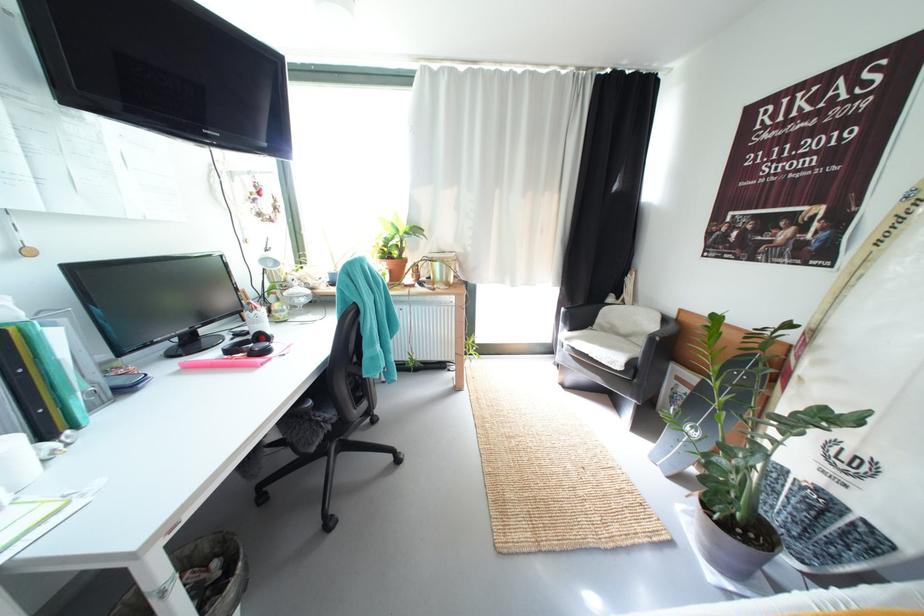
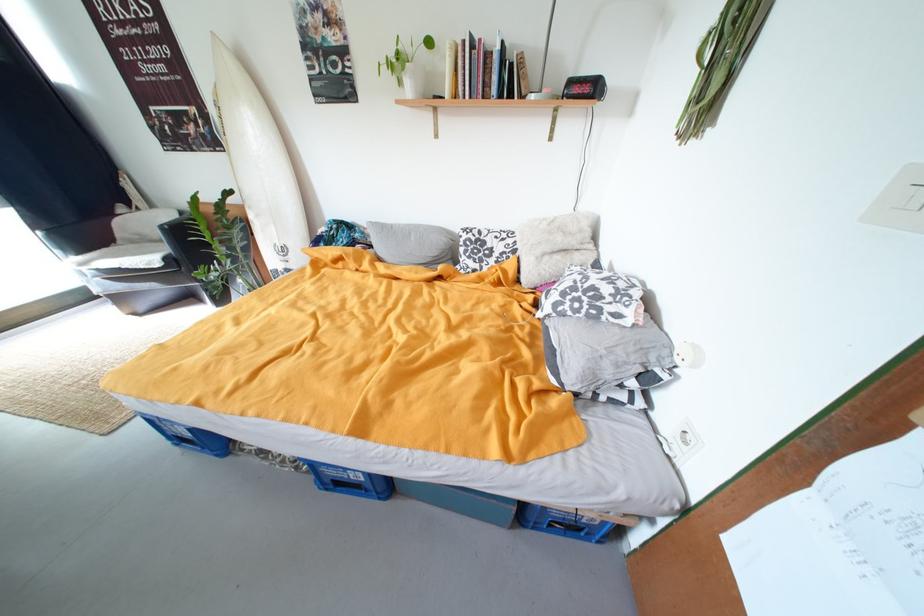
Locate, in the second image, the point that corresponds to the point at 633,338 in the first image.

(169, 243)